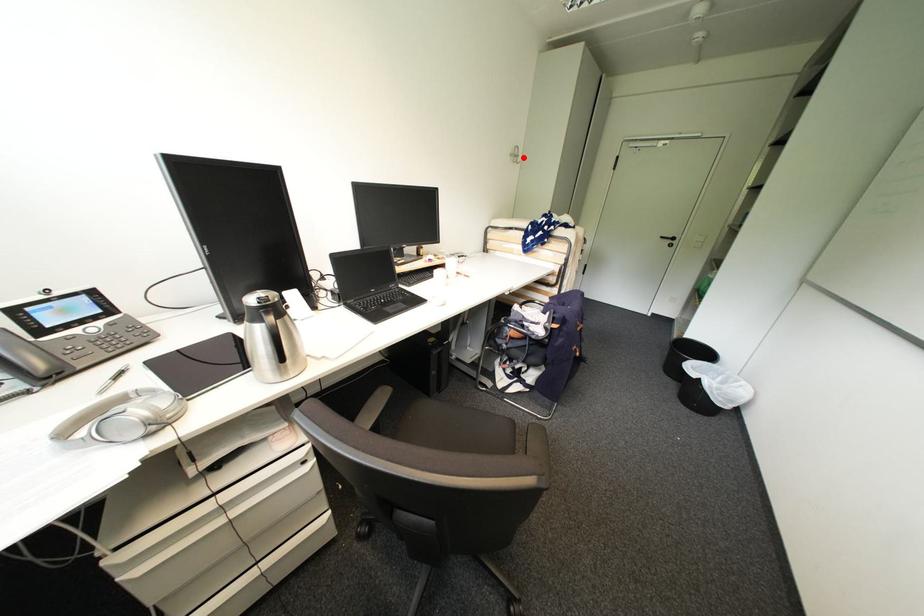
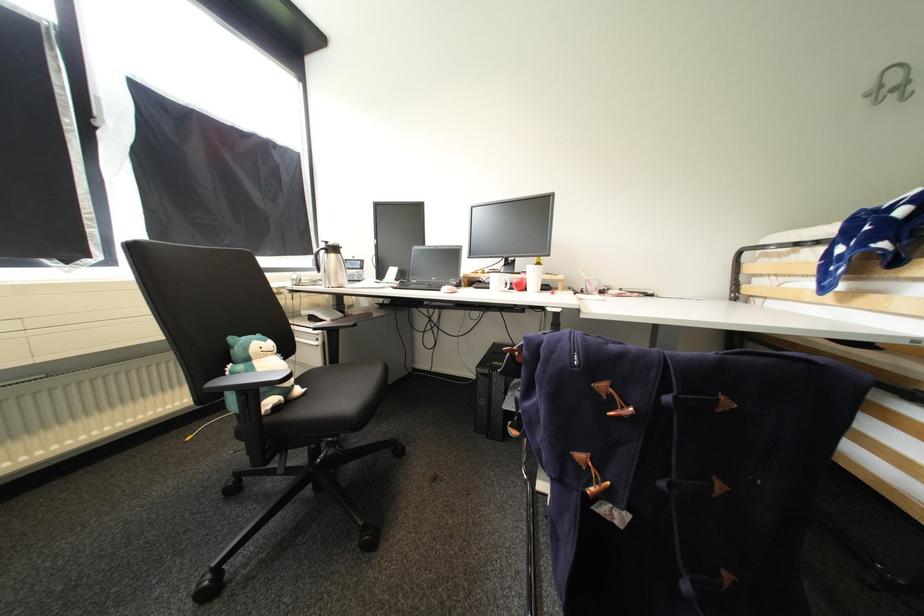
Find the pixel in the second image that matches the highlighted location in the first image.

(912, 84)